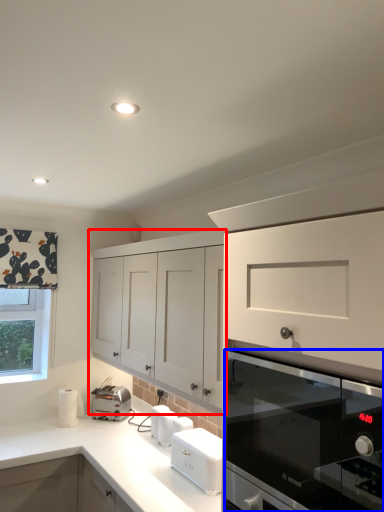
Question: Among these objects, which one is farthest to the camera, cabinetry (highlighted by a red box) or home appliance (highlighted by a blue box)?

Choices:
 (A) cabinetry
 (B) home appliance

Answer: (A)